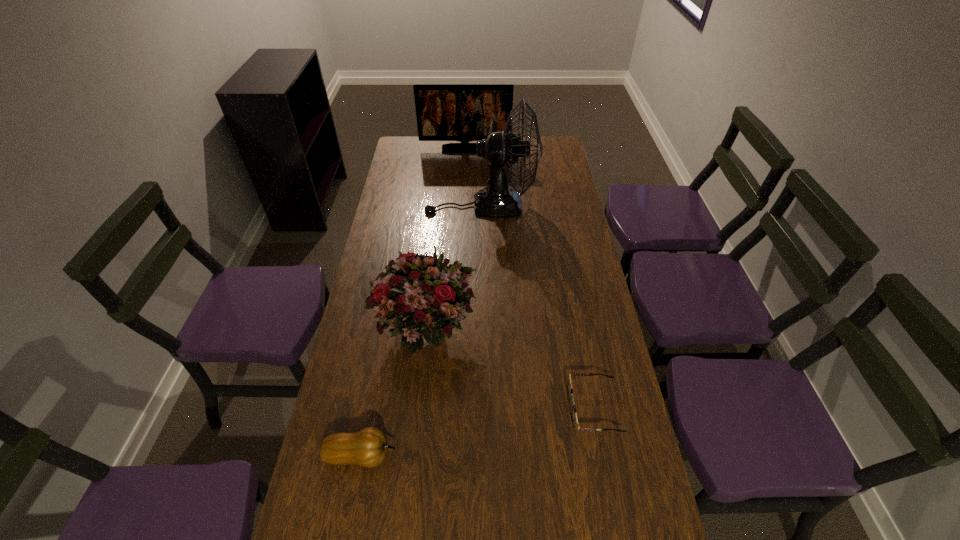
Where is `object that is at the right edge`? The width and height of the screenshot is (960, 540). object that is at the right edge is located at coordinates (574, 418).

This screenshot has width=960, height=540. Find the location of `object that is at the far left corner`. object that is at the far left corner is located at coordinates (445, 112).

The image size is (960, 540). Find the location of `vacant region at the far edge of the desktop`. vacant region at the far edge of the desktop is located at coordinates (468, 157).

I want to click on vacant space at the left edge, so (362, 330).

Where is `free region at the right edge of the desktop`? free region at the right edge of the desktop is located at coordinates (567, 270).

Where is `vacant space at the far right corner of the desktop`? The image size is (960, 540). vacant space at the far right corner of the desktop is located at coordinates (559, 138).

Identify the location of free space between the monitor and the spectacles. (529, 279).

Find the location of a particular element. This screenshot has width=960, height=540. vacant space that's between the monitor and the tallest object is located at coordinates pyautogui.click(x=473, y=177).

Identify the location of free space between the shortest object and the third nearest object. (509, 370).

Find the location of a particular element. This screenshot has width=960, height=540. free spot between the bouquet and the spectacles is located at coordinates (509, 370).